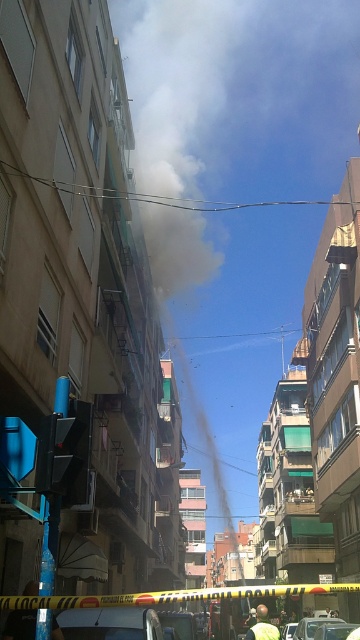
You are a firefighter assessing the scene. You see the white smoke at center and the yellow fabric shirt at center. Which object is wider?

The white smoke at center is wider than the yellow fabric shirt at center.